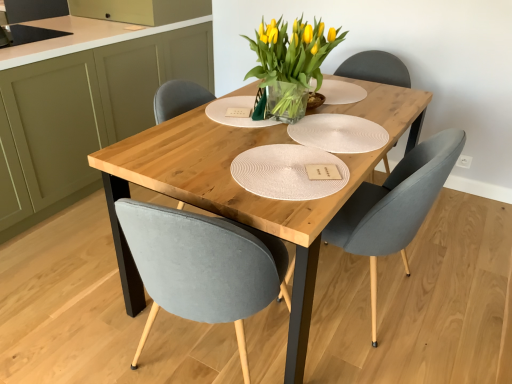
Question: Is point (311, 127) positioned closer to the camera than point (424, 165)?

Choices:
 (A) farther
 (B) closer

Answer: (A)

Question: From their relative heights in the image, would you say white textured paper plate at center is taller or shorter than velvet grey chair at center?

Choices:
 (A) short
 (B) tall

Answer: (A)

Question: Based on their relative distances, which object is farther from the natural wood table at center?

Choices:
 (A) matte olive green cabinet at left
 (B) velvet grey chair at center
 (C) translucent glass vase at center
 (D) white textured paper plate at center

Answer: (A)

Question: Estimate the real-world distances between objects in this image. Which object is farther from the velvet grey chair at center?

Choices:
 (A) matte olive green cabinet at left
 (B) natural wood table at center
 (C) translucent glass vase at center
 (D) white textured paper plate at center

Answer: (A)